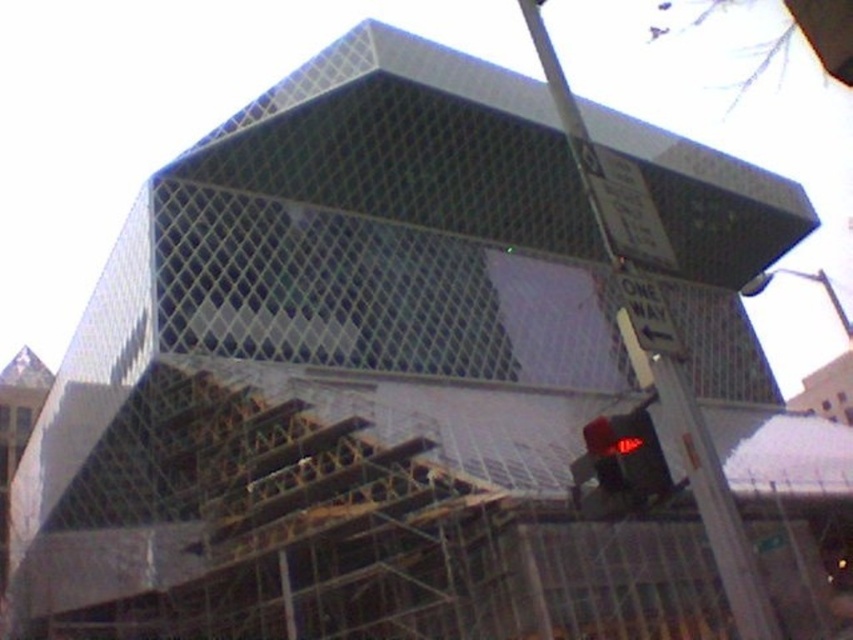
Question: Does red glass traffic light at lower right appear over white plastic street sign at right?

Choices:
 (A) no
 (B) yes

Answer: (A)

Question: Which point is farther to the camera?

Choices:
 (A) metallic pole at right
 (B) red glass traffic light at lower right

Answer: (A)

Question: Observing the image, what is the correct spatial positioning of metallic pole at right in reference to red glass traffic light at lower right?

Choices:
 (A) left
 (B) right

Answer: (B)

Question: Does red glass traffic light at lower right appear over white plastic street sign at right?

Choices:
 (A) yes
 (B) no

Answer: (B)

Question: Which of the following is the farthest from the observer?

Choices:
 (A) (753, 595)
 (B) (608, 509)
 (C) (641, 348)

Answer: (C)

Question: Which of the following is the farthest from the observer?

Choices:
 (A) white plastic street sign at right
 (B) red glass traffic light at lower right

Answer: (A)